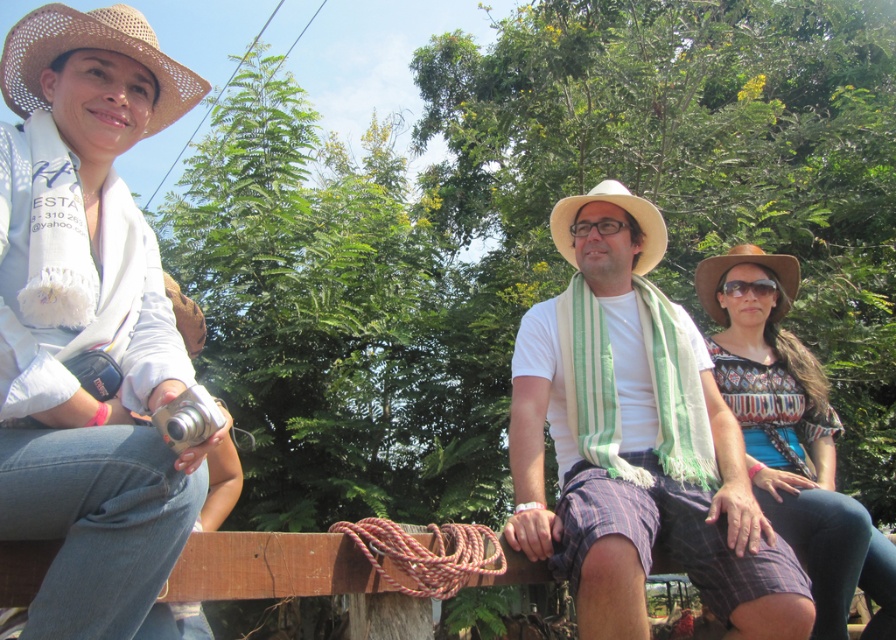
You are a photographer standing 1.5 meters away from the camera. You want to reach the white cotton shirt at center to adjust its position. Can you do so without moving the camera?

The distance between the white cotton shirt at center and the camera is 2.97 meters. Since you are already 1.5 meters away from the camera, you would need to cover an additional 1.47 meters to reach the white cotton shirt at center. Therefore, you can reach it without moving the camera.

Looking at this image, is the point at coordinates [635,440] located on the white cotton shirt at center?

Yes, the point at coordinates [635,440] is located on the white cotton shirt at center.